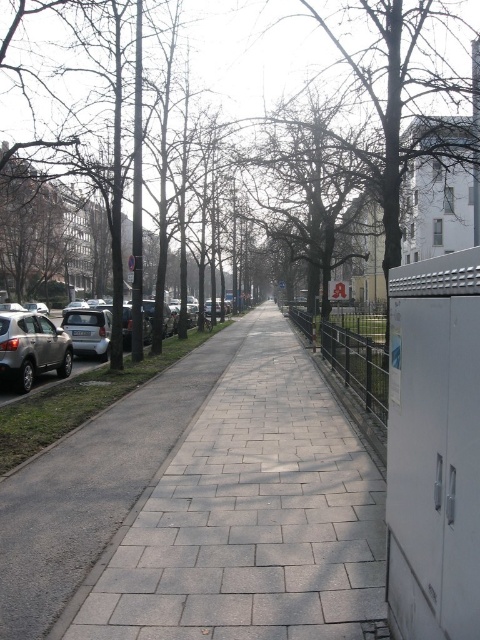
You are a delivery person trying to park your vehicle in the parking area near the gray concrete pavement at center and the satin silver suv at left. Considering the size of the available parking spots, can your standard size delivery van fit between them?

The gray concrete pavement at center is larger in size than the satin silver suv at left. Since the pavement is bigger, the standard size delivery van should fit between them as there is enough space provided by the larger pavement area.

You are standing at the entrance of the pathway and want to walk to the gray concrete pavement at center. According to the scene description, where should you head?

The gray concrete pavement at center is located at point [249,516], so you should head towards the center of the pathway where the coordinates indicate its position.